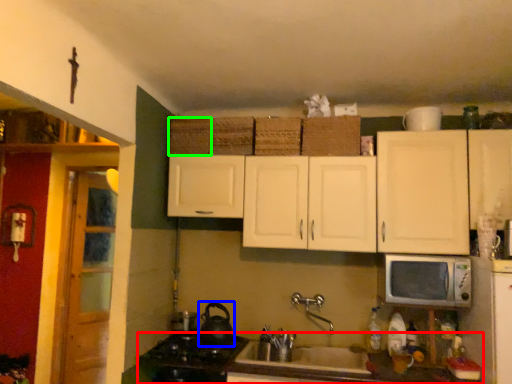
Question: Which object is the farthest from countertop (highlighted by a red box)? Choose among these: tea pot (highlighted by a blue box) or basket (highlighted by a green box).

Choices:
 (A) tea pot
 (B) basket

Answer: (B)